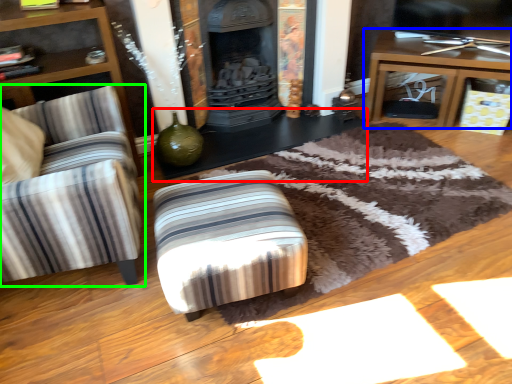
Question: Estimate the real-world distances between objects in this image. Which object is farther from table (highlighted by a red box), table (highlighted by a blue box) or chair (highlighted by a green box)?

Choices:
 (A) table
 (B) chair

Answer: (B)